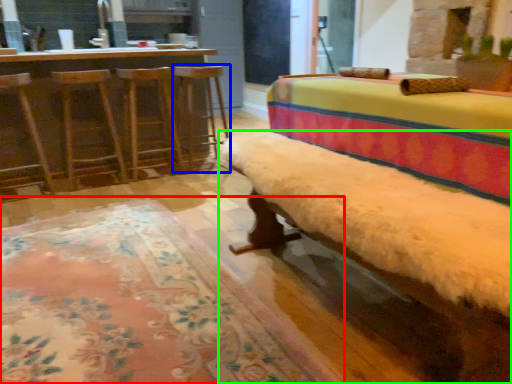
Question: Which object is the closest to the mat (highlighted by a red box)? Choose among these: bar stool (highlighted by a blue box) or furniture (highlighted by a green box).

Choices:
 (A) bar stool
 (B) furniture

Answer: (B)